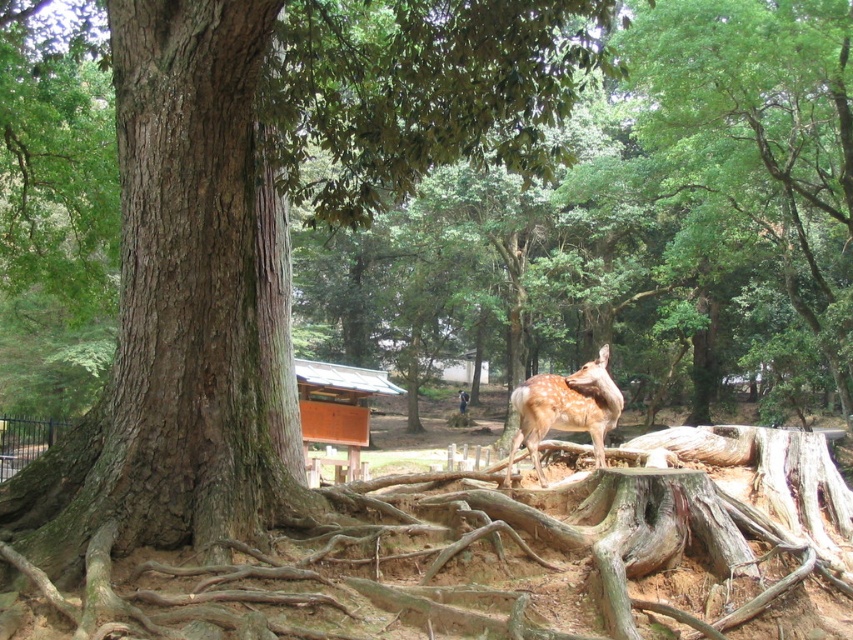
Locate an element on the screen. Image resolution: width=853 pixels, height=640 pixels. brown rough tree roots at center is located at coordinates (492, 557).

Is brown rough tree roots at center smaller than orange wood/hardwood hut at center?

Indeed, brown rough tree roots at center has a smaller size compared to orange wood/hardwood hut at center.

This screenshot has width=853, height=640. What do you see at coordinates (492, 557) in the screenshot?
I see `brown rough tree roots at center` at bounding box center [492, 557].

This screenshot has height=640, width=853. Find the location of `brown rough tree roots at center`. brown rough tree roots at center is located at coordinates (492, 557).

Does point (514, 449) lie behind point (318, 372)?

No, it is in front of (318, 372).

Consider the image. Between fawn fur deer at center and orange wood/hardwood hut at center, which one appears on the right side from the viewer's perspective?

From the viewer's perspective, fawn fur deer at center appears more on the right side.

Locate an element on the screen. fawn fur deer at center is located at coordinates [566, 408].

Who is more distant from viewer, [809,525] or [141,52]?

Point [809,525]

Where is `brown rough tree roots at center`? brown rough tree roots at center is located at coordinates (492, 557).

Locate an element on the screen. Image resolution: width=853 pixels, height=640 pixels. brown rough tree roots at center is located at coordinates (492, 557).